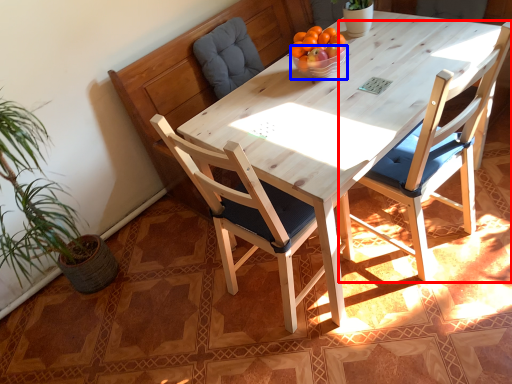
Question: Which object is closer to the camera taking this photo, chair (highlighted by a red box) or bowl (highlighted by a blue box)?

Choices:
 (A) chair
 (B) bowl

Answer: (A)